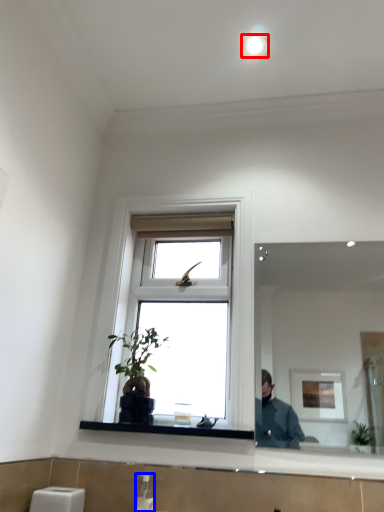
Question: Among these objects, which one is nearest to the camera, light fixture (highlighted by a red box) or soap dispenser (highlighted by a blue box)?

Choices:
 (A) light fixture
 (B) soap dispenser

Answer: (B)